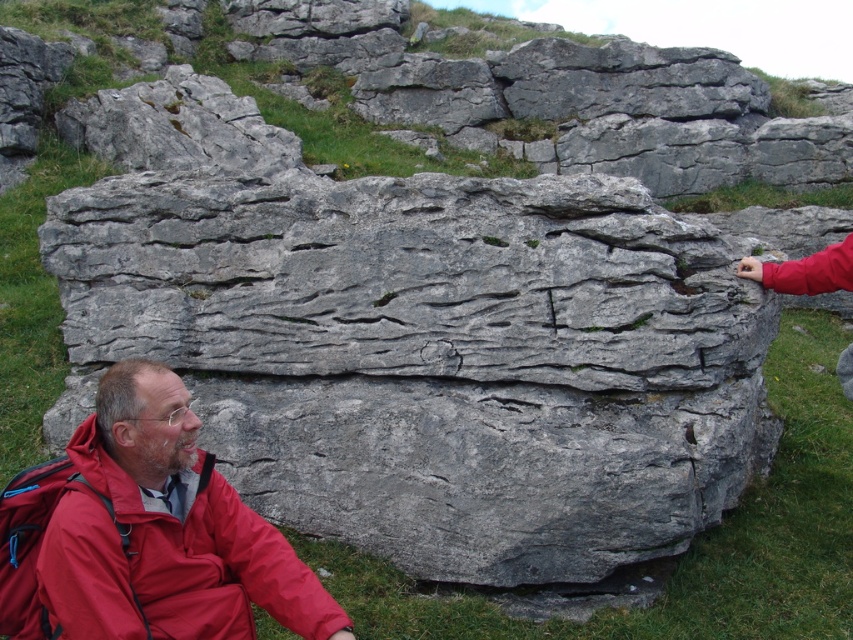
Question: Among these objects, which one is farthest from the camera?

Choices:
 (A) red nylon jacket at lower left
 (B) gray rock at center

Answer: (B)

Question: Does gray rock at center have a lesser width compared to red nylon jacket at lower left?

Choices:
 (A) yes
 (B) no

Answer: (B)

Question: Is gray rock at center positioned behind red nylon jacket at lower left?

Choices:
 (A) yes
 (B) no

Answer: (A)

Question: Can you confirm if gray rock at center is positioned above red nylon jacket at lower left?

Choices:
 (A) yes
 (B) no

Answer: (A)

Question: Among these points, which one is nearest to the camera?

Choices:
 (A) (525, 86)
 (B) (132, 429)

Answer: (B)